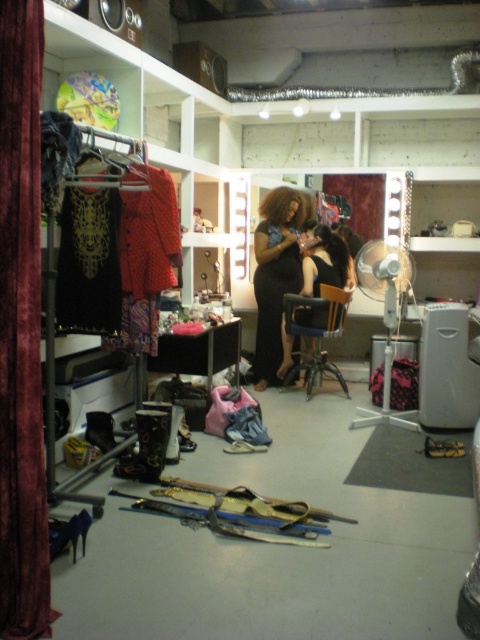
Question: Is shiny black dress at center below black leather chair at center?

Choices:
 (A) yes
 (B) no

Answer: (B)

Question: Which object is the closest to the black lace dress at left?

Choices:
 (A) velvet curtain at left
 (B) black matte hair at center
 (C) shiny black dress at center
 (D) white plastic fan at right

Answer: (A)

Question: Is velvet curtain at left wider than shiny black dress at center?

Choices:
 (A) no
 (B) yes

Answer: (A)

Question: Which point is farther to the camera?

Choices:
 (A) (305, 208)
 (B) (313, 314)

Answer: (A)

Question: Which object appears farthest from the camera in this image?

Choices:
 (A) white plastic fan at right
 (B) velvet curtain at left
 (C) black matte hair at center

Answer: (C)

Question: Can you confirm if shiny black dress at center is bigger than black leather chair at center?

Choices:
 (A) yes
 (B) no

Answer: (A)